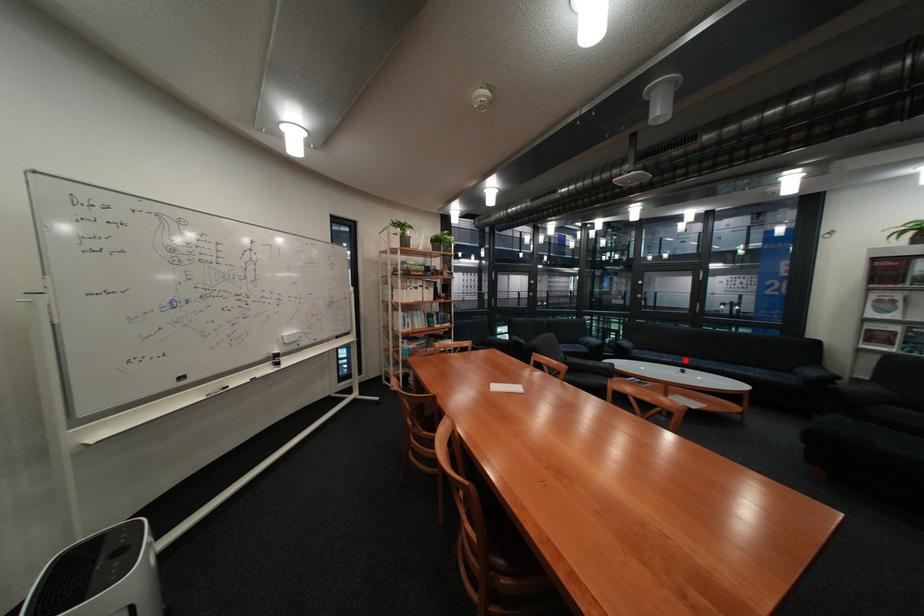
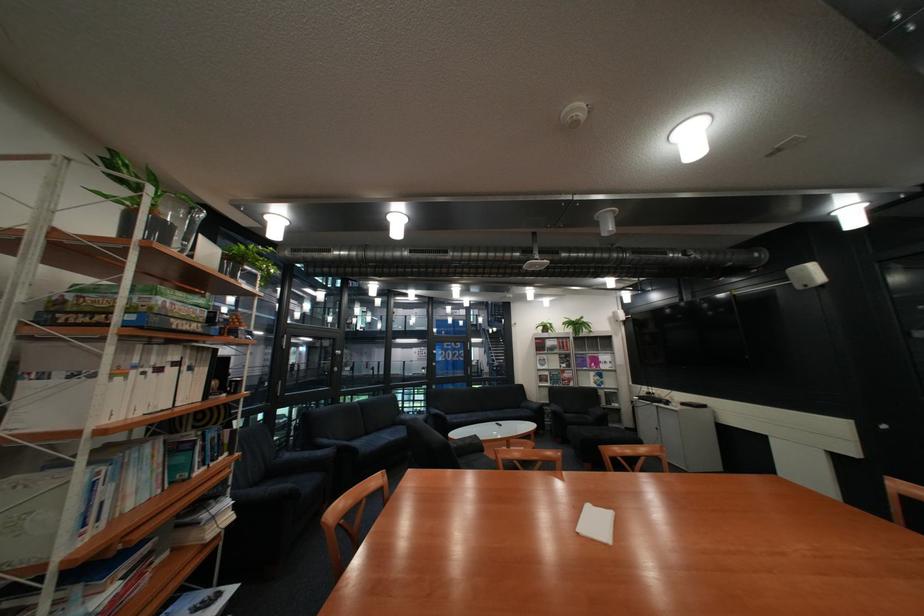
Question: I am providing you with two images of the same scene from different viewpoints. In image1, a red point is highlighted. Considering the same 3D point in image2, which of the following is correct?

Choices:
 (A) It is closer
 (B) It is farther

Answer: (A)